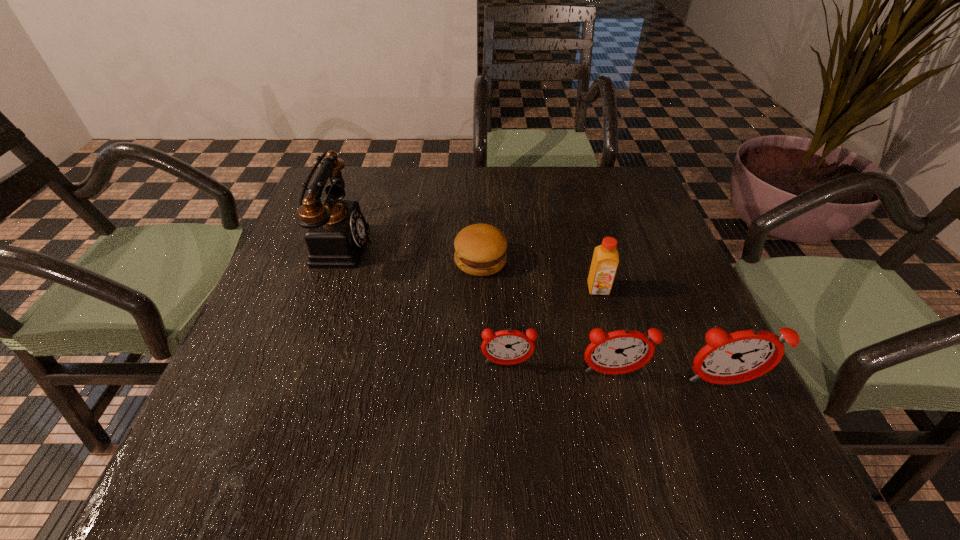
Please point out where to position a new alarm clock on the left to maintain spacing. Please provide its 2D coordinates. Your answer should be formatted as a tuple, i.e. [(x, y)], where the tuple contains the x and y coordinates of a point satisfying the conditions above.

[(405, 355)]